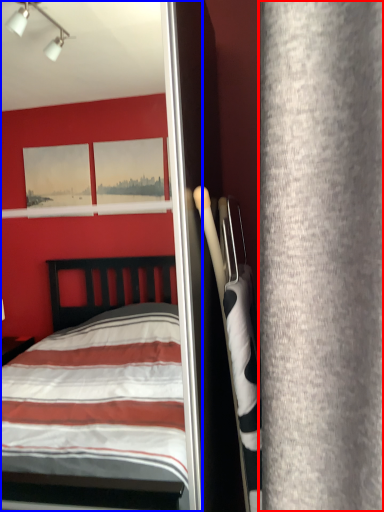
Question: Among these objects, which one is farthest to the camera, curtain (highlighted by a red box) or screen door (highlighted by a blue box)?

Choices:
 (A) curtain
 (B) screen door

Answer: (B)